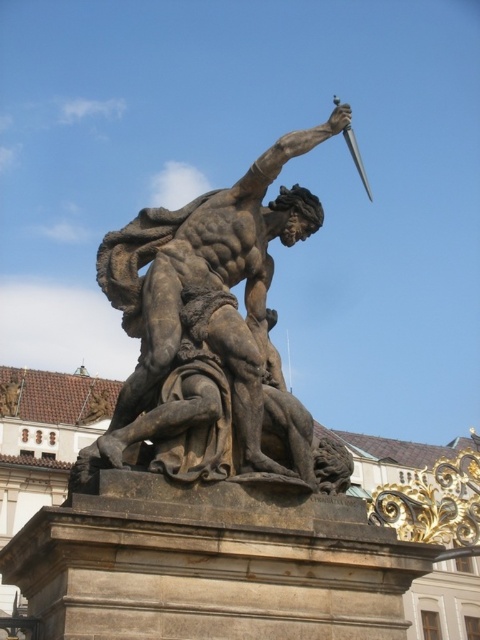
Question: Among these points, which one is farthest from the camera?

Choices:
 (A) (192, 260)
 (B) (358, 170)

Answer: (B)

Question: Can you confirm if bronze statue at center is positioned to the left of shiny silver sword at upper right?

Choices:
 (A) yes
 (B) no

Answer: (A)

Question: Among these points, which one is farthest from the camera?

Choices:
 (A) (236, 276)
 (B) (349, 124)

Answer: (B)

Question: Is bronze statue at center below shiny silver sword at upper right?

Choices:
 (A) yes
 (B) no

Answer: (A)

Question: Among these objects, which one is farthest from the camera?

Choices:
 (A) shiny silver sword at upper right
 (B) bronze statue at center

Answer: (A)

Question: Is bronze statue at center positioned before shiny silver sword at upper right?

Choices:
 (A) yes
 (B) no

Answer: (A)